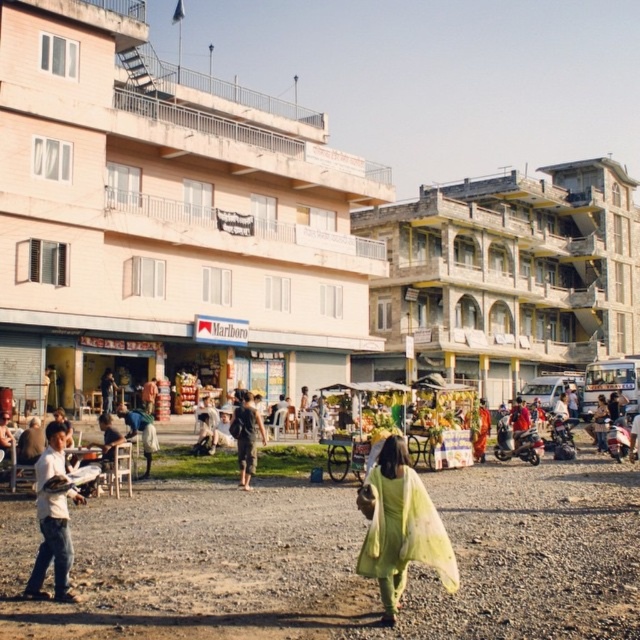
Question: Does light green fabric at center appear on the left side of dark brown fabric pants at center?

Choices:
 (A) no
 (B) yes

Answer: (A)

Question: Which point is farther to the camera?

Choices:
 (A) dusty gravel field at center
 (B) white cotton shirt at lower left
 (C) light green fabric at center
 (D) dark brown fabric pants at center

Answer: (D)

Question: Based on their relative distances, which object is nearer to the dusty gravel field at center?

Choices:
 (A) dark brown fabric pants at center
 (B) light green fabric at center
 (C) white cotton shirt at lower left

Answer: (B)

Question: Does dusty gravel field at center have a lesser width compared to light green fabric at center?

Choices:
 (A) yes
 (B) no

Answer: (B)

Question: Which object is positioned closest to the white cotton shirt at lower left?

Choices:
 (A) dusty gravel field at center
 (B) dark brown fabric pants at center
 (C) light green fabric at center

Answer: (A)

Question: Is dusty gravel field at center above dark brown fabric pants at center?

Choices:
 (A) yes
 (B) no

Answer: (B)